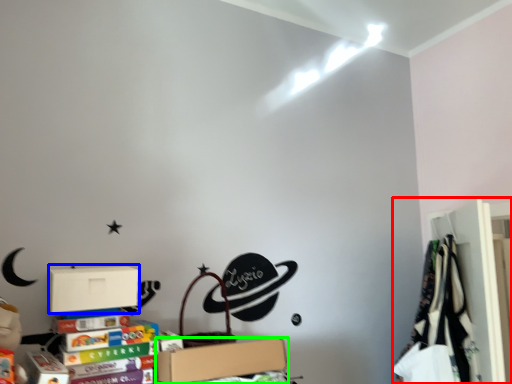
Question: Based on their relative distances, which object is nearer to closet (highlighted by a red box)? Choose from cardboard box (highlighted by a blue box) and box (highlighted by a green box).

Choices:
 (A) cardboard box
 (B) box

Answer: (B)